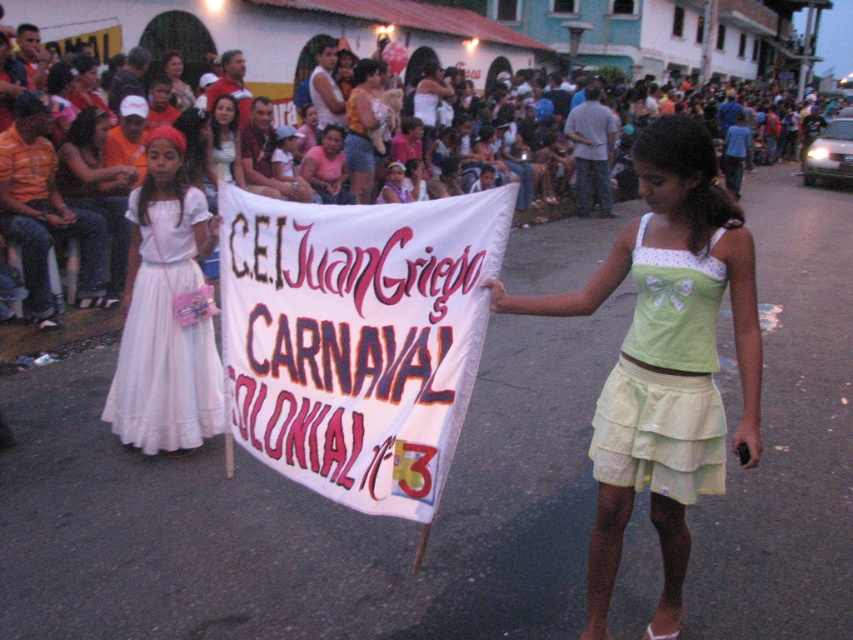
You are a photographer trying to capture the entire white paper banner at center and light green cotton skirt at center in a single shot. Based on their sizes, do you think you can fit both in the frame without cropping either?

The white paper banner at center might be wider than light green cotton skirt at center, so there is a possibility that the banner could take up more space in the frame, but since both are at the center, adjusting the camera angle or zoom might help include both without cropping.